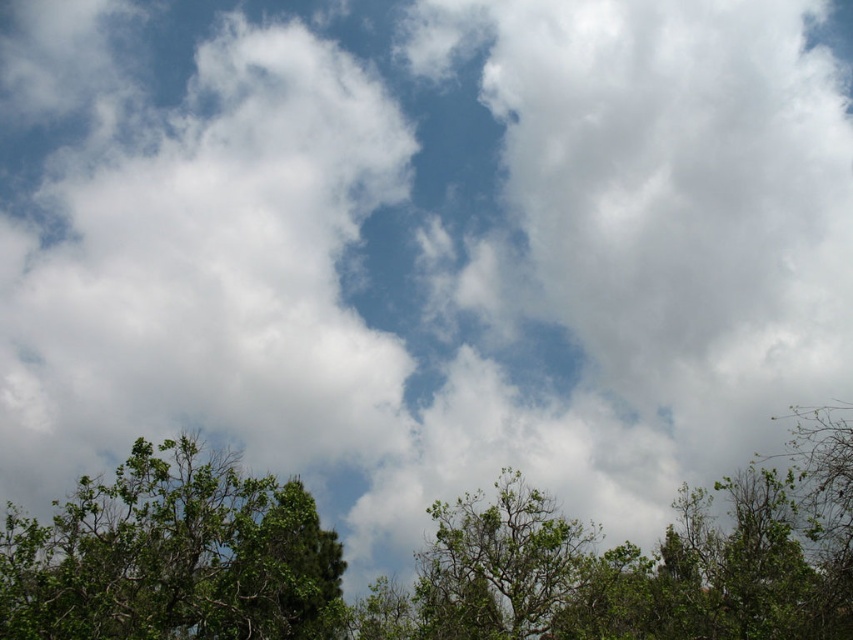
Describe the element at coordinates (172, 556) in the screenshot. I see `green leafy tree at lower left` at that location.

Is green leafy tree at lower left above green leafy tree at center?

No, green leafy tree at lower left is not above green leafy tree at center.

Does point (260, 556) lie in front of point (473, 500)?

Yes, point (260, 556) is closer to viewer.

The width and height of the screenshot is (853, 640). I want to click on green leafy tree at lower left, so click(x=172, y=556).